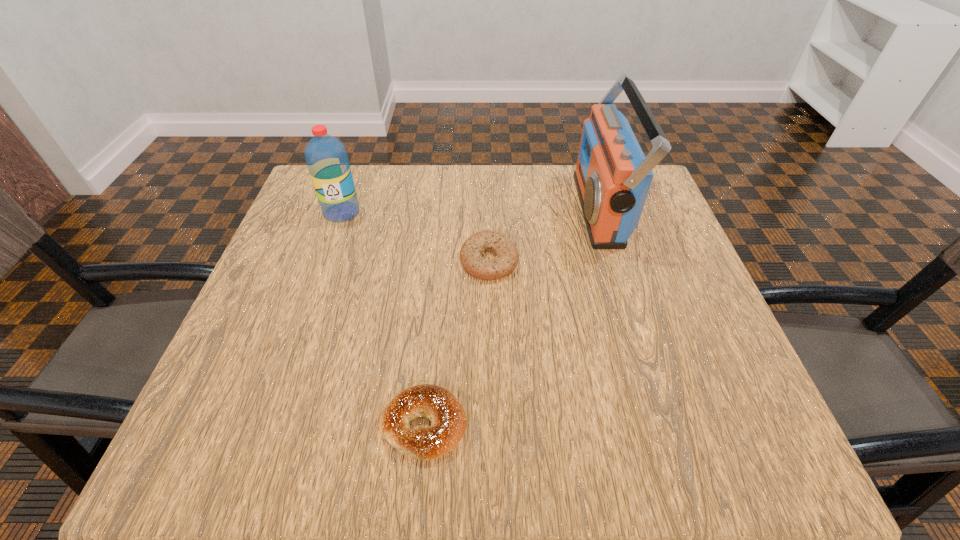
You are a GUI agent. You are given a task and a screenshot of the screen. Output one action in this format:
    pyautogui.click(x=<x>, y=<y>)
    Task: Click on the free space at the near edge of the desktop
    The height and width of the screenshot is (540, 960).
    Given the screenshot: What is the action you would take?
    pyautogui.click(x=439, y=463)

You are a GUI agent. You are given a task and a screenshot of the screen. Output one action in this format:
    pyautogui.click(x=<x>, y=<y>)
    Task: Click on the vacant space at the left edge
    Image resolution: width=960 pixels, height=540 pixels.
    Given the screenshot: What is the action you would take?
    click(x=319, y=341)

The image size is (960, 540). What are the coordinates of `vacant space at the right edge of the desktop` in the screenshot? It's located at (708, 298).

At what (x,y) coordinates should I click in order to perform the action: click on vacant space at the far right corner of the desktop. Please return your answer as a coordinate pair (x, y). The image size is (960, 540). Looking at the image, I should click on (652, 209).

You are a GUI agent. You are given a task and a screenshot of the screen. Output one action in this format:
    pyautogui.click(x=<x>, y=<y>)
    Task: Click on the free space between the farther bagel and the tallest object
    
    Given the screenshot: What is the action you would take?
    pyautogui.click(x=544, y=235)

Find the location of `vacant area that lies between the farther bagel and the third shortest object`. vacant area that lies between the farther bagel and the third shortest object is located at coordinates (416, 237).

The height and width of the screenshot is (540, 960). I want to click on vacant space that's between the nearer bagel and the radio receiver, so click(512, 317).

This screenshot has height=540, width=960. I want to click on free space between the farther bagel and the tallest object, so 544,235.

Find the location of `blank region between the farther bagel and the water bottle`. blank region between the farther bagel and the water bottle is located at coordinates (416, 237).

The height and width of the screenshot is (540, 960). I want to click on vacant space in between the nearer bagel and the leftmost object, so click(x=383, y=319).